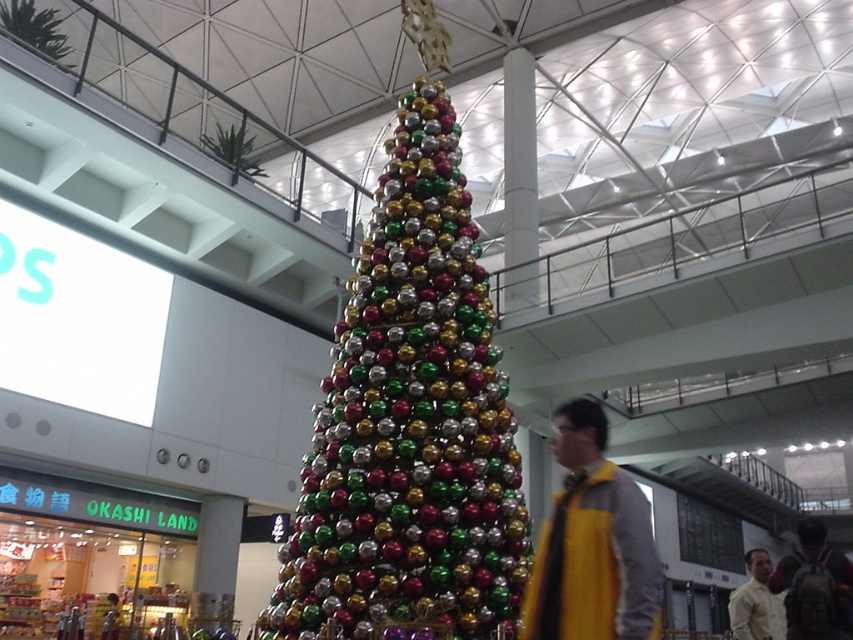
Who is more forward, (560, 538) or (792, 621)?

Point (560, 538)

Image resolution: width=853 pixels, height=640 pixels. What are the coordinates of `yellow fabric at center` in the screenshot? It's located at (592, 545).

Can you confirm if shiny metallic ornaments at center is taller than yellow fabric at center?

Yes, shiny metallic ornaments at center is taller than yellow fabric at center.

Describe the element at coordinates (410, 420) in the screenshot. The width and height of the screenshot is (853, 640). I see `shiny metallic ornaments at center` at that location.

The width and height of the screenshot is (853, 640). What do you see at coordinates (410, 420) in the screenshot?
I see `shiny metallic ornaments at center` at bounding box center [410, 420].

Identify the location of shiny metallic ornaments at center. The width and height of the screenshot is (853, 640). (410, 420).

Is shiny metallic ornaments at center closer to camera compared to yellow wool sweater at center?

That is True.

Which is more to the right, shiny metallic ornaments at center or yellow wool sweater at center?

yellow wool sweater at center

Identify the location of shiny metallic ornaments at center. (410, 420).